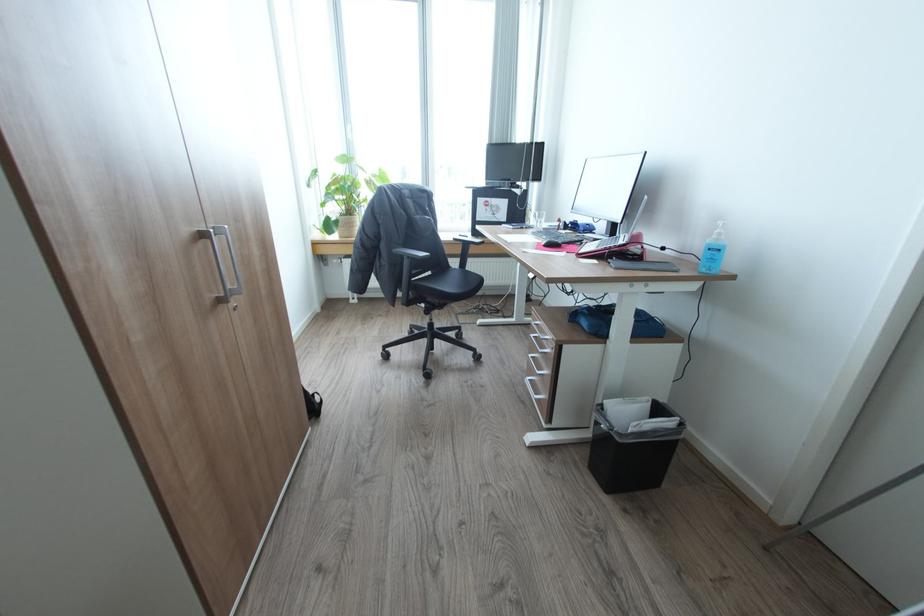
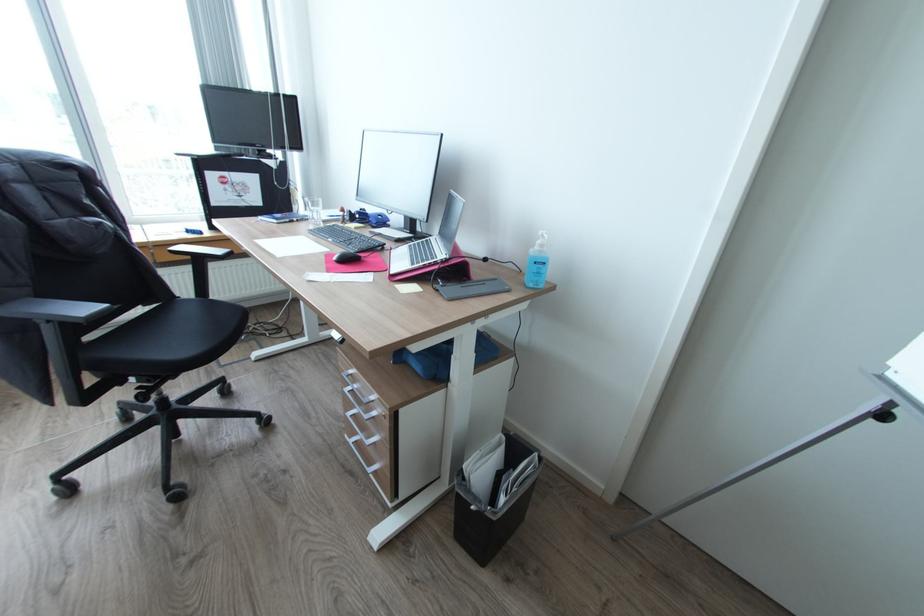
The point at (412, 257) is marked in the first image. Where is the corresponding point in the second image?

(55, 321)